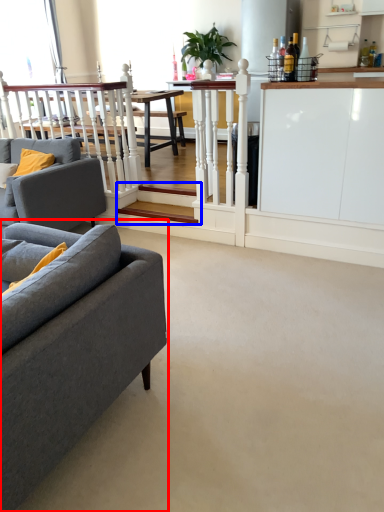
Question: Which point is further to the camera, studio couch (highlighted by a red box) or stairwell (highlighted by a blue box)?

Choices:
 (A) studio couch
 (B) stairwell

Answer: (B)